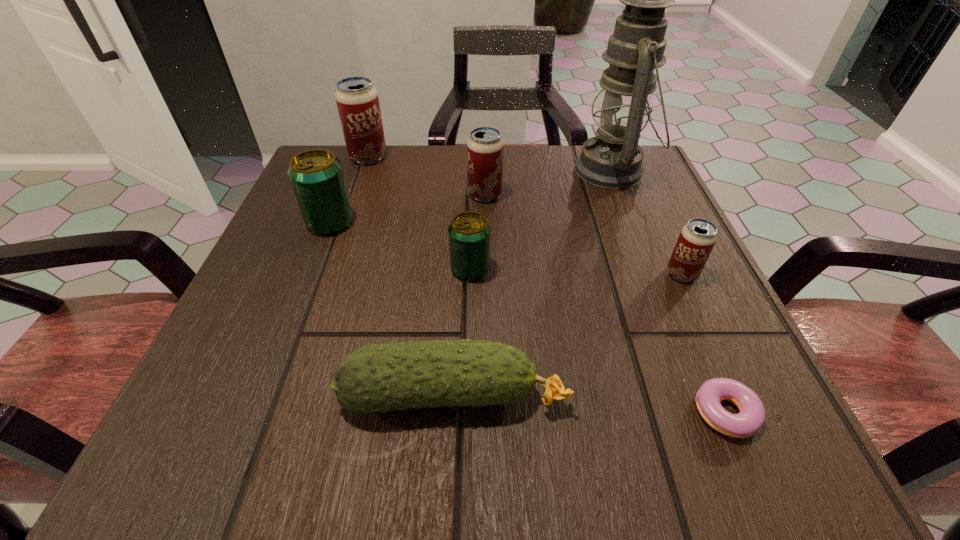
Choose which beer can is the nearest neighbor to the left green beer can. Please provide its 2D coordinates. Your answer should be formatted as a tuple, i.e. [(x, y)], where the tuple contains the x and y coordinates of a point satisfying the conditions above.

[(357, 100)]

Identify which red beer can is located as the nearest to the smallest red beer can. Please provide its 2D coordinates. Your answer should be formatted as a tuple, i.e. [(x, y)], where the tuple contains the x and y coordinates of a point satisfying the conditions above.

[(485, 146)]

Find the location of a particular element. The height and width of the screenshot is (540, 960). the second closest red beer can to the nearest red beer can is located at coordinates (357, 100).

You are a GUI agent. You are given a task and a screenshot of the screen. Output one action in this format:
    pyautogui.click(x=<x>, y=<y>)
    Task: Click on the free location that satisfies the following two spatial constraints: 1. on the back side of the seventh shortest object; 2. on the right side of the fifth nearest object
    
    Given the screenshot: What is the action you would take?
    pyautogui.click(x=356, y=157)

The height and width of the screenshot is (540, 960). Find the location of `blank space that satisfies the following two spatial constraints: 1. on the front side of the rightmost red beer can; 2. at the blossom end of the cucumber`. blank space that satisfies the following two spatial constraints: 1. on the front side of the rightmost red beer can; 2. at the blossom end of the cucumber is located at coordinates pyautogui.click(x=737, y=395).

Identify the location of free space that satisfies the following two spatial constraints: 1. on the front side of the nearer green beer can; 2. on the right side of the second tallest object. This screenshot has width=960, height=540. (329, 269).